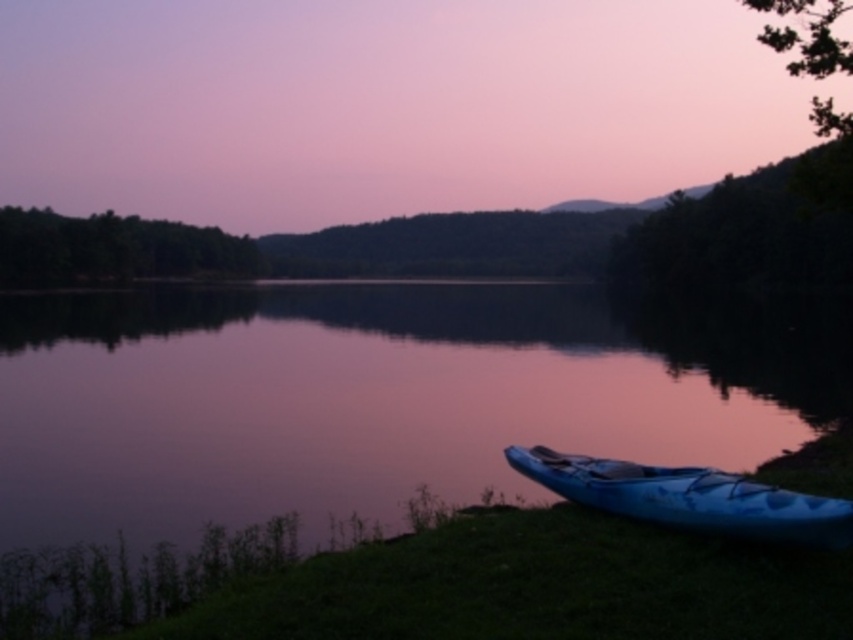
Question: Which object is farther from the camera taking this photo?

Choices:
 (A) blue glossy kayak at lower right
 (B) smooth water at lake center

Answer: (A)

Question: Does smooth water at lake center have a lesser width compared to blue glossy kayak at lower right?

Choices:
 (A) no
 (B) yes

Answer: (A)

Question: Is smooth water at lake center smaller than blue glossy kayak at lower right?

Choices:
 (A) yes
 (B) no

Answer: (B)

Question: Is smooth water at lake center wider than blue glossy kayak at lower right?

Choices:
 (A) no
 (B) yes

Answer: (B)